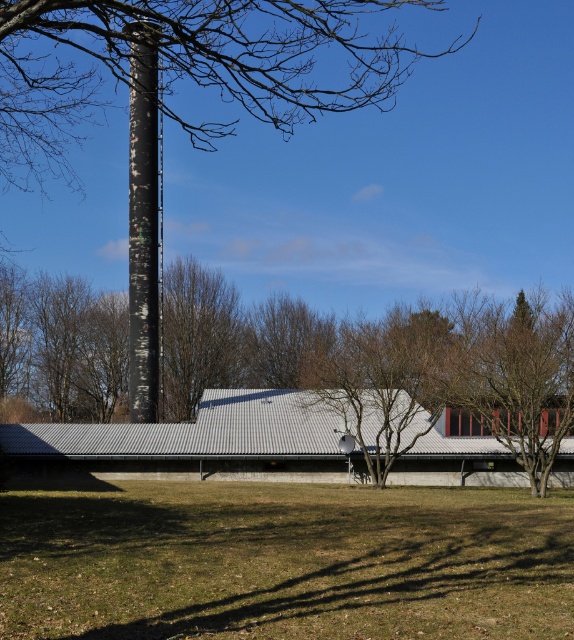
I want to click on green grass at lower center, so click(281, 561).

Which is in front, point (313, 605) or point (40, 384)?

Point (313, 605) is in front.

Who is more forward, (498, 492) or (191, 257)?

Point (498, 492) is more forward.

This screenshot has width=574, height=640. I want to click on green grass at lower center, so click(281, 561).

Can you confirm if brown textured tree at center is thinner than gray corrugated metal barn at center?

In fact, brown textured tree at center might be wider than gray corrugated metal barn at center.

Can you confirm if brown textured tree at center is bigger than gray corrugated metal barn at center?

Indeed, brown textured tree at center has a larger size compared to gray corrugated metal barn at center.

Does point (478, 420) come closer to viewer compared to point (224, 460)?

No, (478, 420) is behind (224, 460).

Image resolution: width=574 pixels, height=640 pixels. Find the location of `brown textured tree at center`. brown textured tree at center is located at coordinates (223, 364).

Can you confirm if green grass at lower center is smaller than black matte chimney at center?

Yes, green grass at lower center is smaller than black matte chimney at center.

Can you confirm if green grass at lower center is positioned to the right of black matte chimney at center?

Indeed, green grass at lower center is positioned on the right side of black matte chimney at center.

Is point (552, 589) farther from camera compared to point (142, 157)?

No, it is not.

Find the location of a particular element. green grass at lower center is located at coordinates (281, 561).